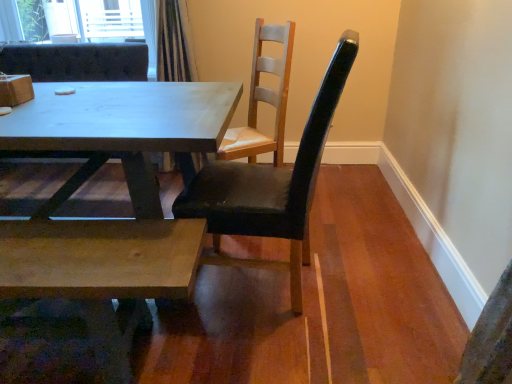
Question: Visually, is light brown wood chair at upper center, acting as the second chair starting from the left, positioned to the left or to the right of matte white chair at center, arranged as the third chair when viewed from the right?

Choices:
 (A) left
 (B) right

Answer: (B)

Question: Is light brown wood chair at upper center, the second chair when ordered from right to left, inside the boundaries of matte white chair at center, arranged as the third chair when viewed from the right, or outside?

Choices:
 (A) inside
 (B) outside

Answer: (B)

Question: Based on their relative distances, which object is farther from the wooden box at upper left?

Choices:
 (A) matte white chair at center, arranged as the third chair when viewed from the right
 (B) matte wood table at center
 (C) light brown wood chair at upper center, the second chair when ordered from right to left
 (D) natural wood coffee table at lower left
 (E) black leather chair at center, the first chair viewed from the right

Answer: (C)

Question: Based on their relative distances, which object is farther from the wooden box at upper left?

Choices:
 (A) matte wood table at center
 (B) natural wood coffee table at lower left
 (C) black leather chair at center, acting as the 3th chair starting from the left
 (D) matte white chair at center, placed as the 1th chair when sorted from left to right
 (E) light brown wood chair at upper center, the second chair when ordered from right to left

Answer: (E)